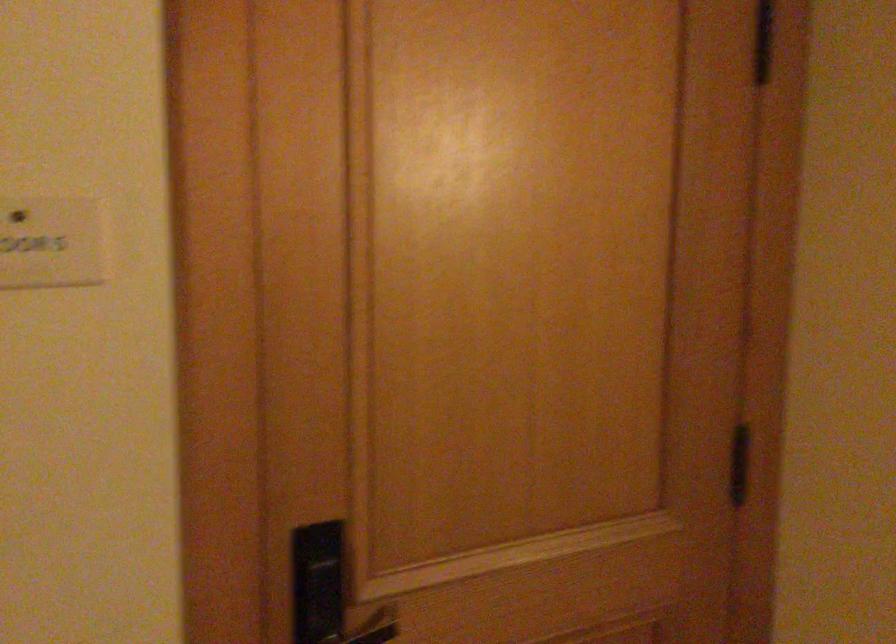
Locate an element on the screen. The width and height of the screenshot is (896, 644). electronic door lock is located at coordinates (738, 464).